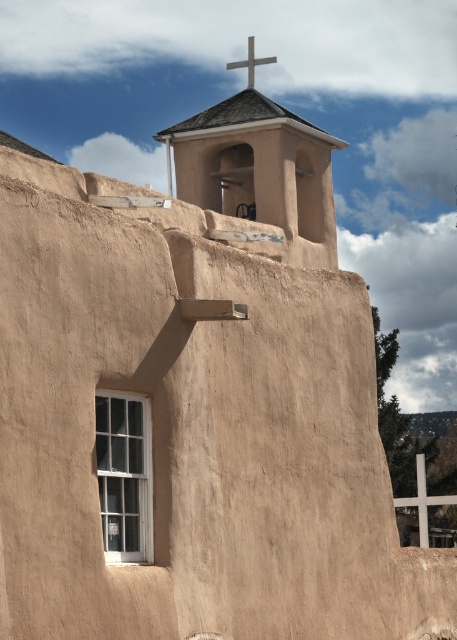
Question: Is light brown stucco bell tower at upper center thinner than silver metallic cross at upper center?

Choices:
 (A) yes
 (B) no

Answer: (B)

Question: Can you confirm if light brown stucco bell tower at upper center is smaller than silver metallic cross at upper center?

Choices:
 (A) no
 (B) yes

Answer: (A)

Question: Which object is closer to the camera taking this photo?

Choices:
 (A) light brown stucco bell tower at upper center
 (B) silver metallic cross at upper center

Answer: (A)

Question: Which of the following is the farthest from the observer?

Choices:
 (A) coord(328,204)
 (B) coord(261,58)

Answer: (B)

Question: In this image, where is light brown stucco bell tower at upper center located relative to silver metallic cross at upper center?

Choices:
 (A) above
 (B) below

Answer: (B)

Question: Which point is closer to the camera?

Choices:
 (A) light brown stucco bell tower at upper center
 (B) silver metallic cross at upper center

Answer: (A)